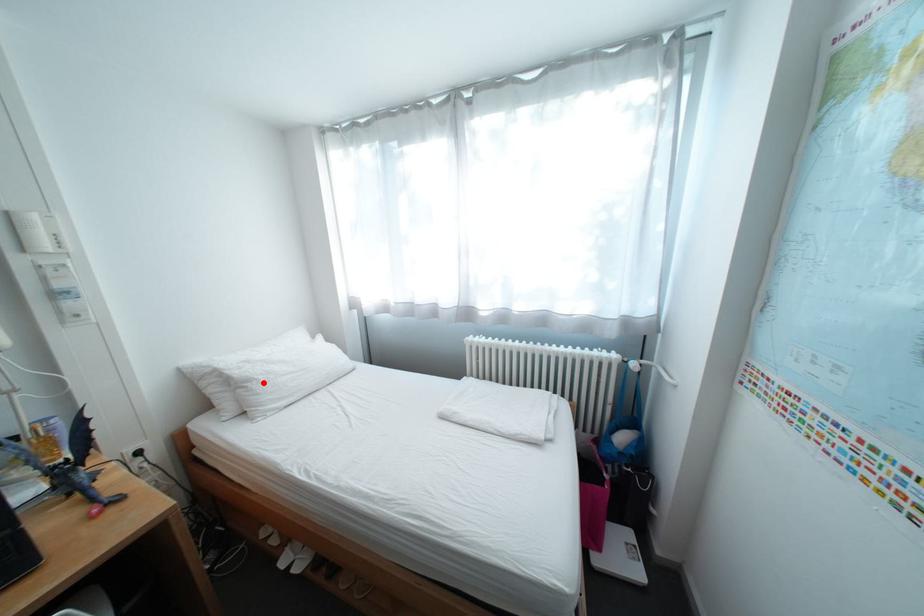
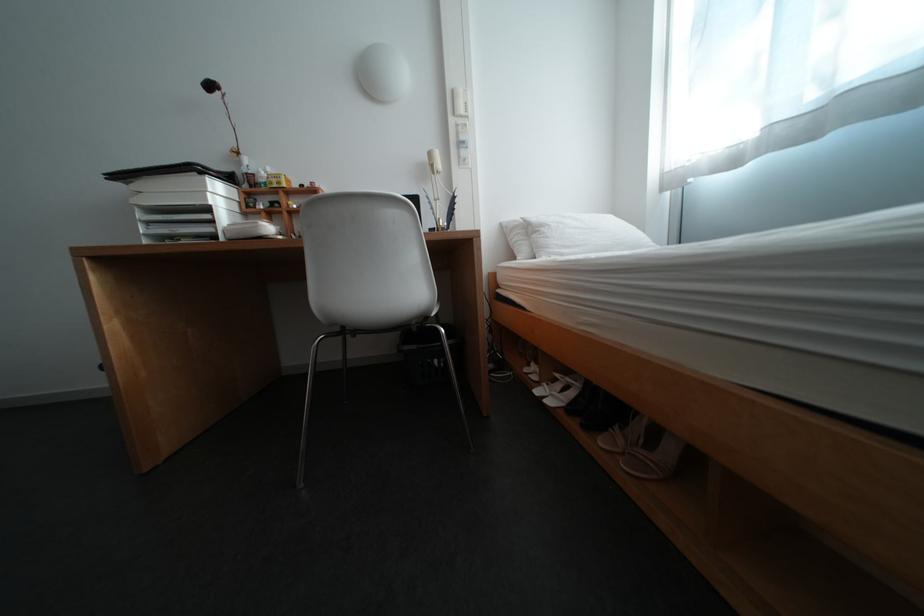
The point at the highlighted location is marked in the first image. Where is the corresponding point in the second image?

(555, 228)